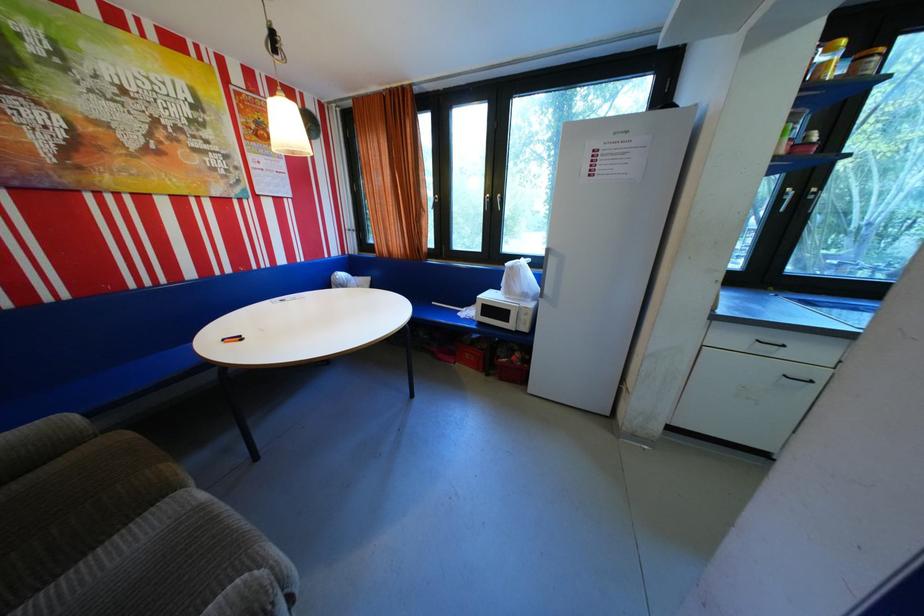
The image size is (924, 616). I want to click on black drawer handle, so click(771, 344).